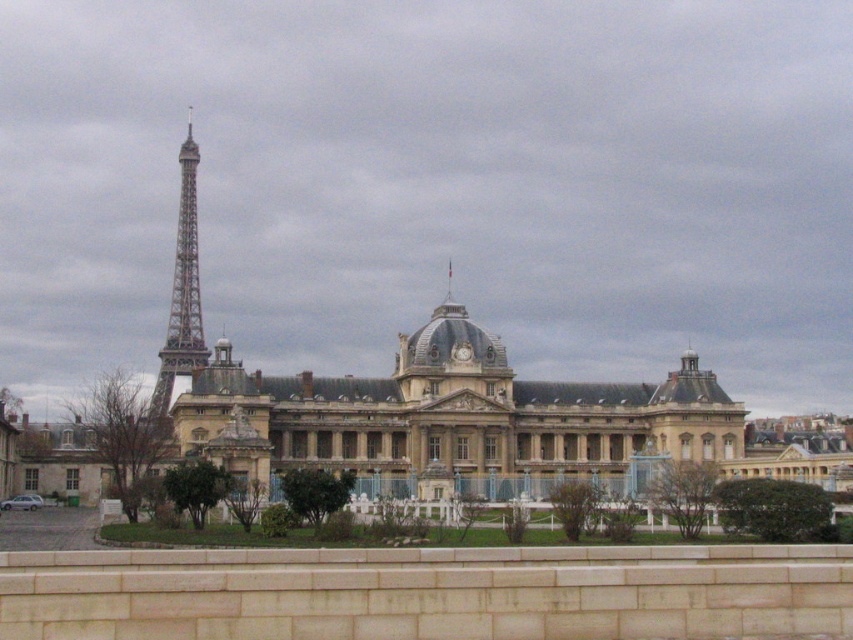
You are a tourist standing in front of the brown stone building at center and the painted steel Eiffel Tower at left. Which structure is closer to you?

The brown stone building at center is closer to you since it is positioned in front of the painted steel Eiffel Tower at left.

You are standing at the point closest to the historic building in the image. There are two points marked in the scene, one at coordinates point(485, 465) and another at point(190, 196). Which of these points is closer to you?

Point(485, 465) is in front of point(190, 196), so it is closer to you.